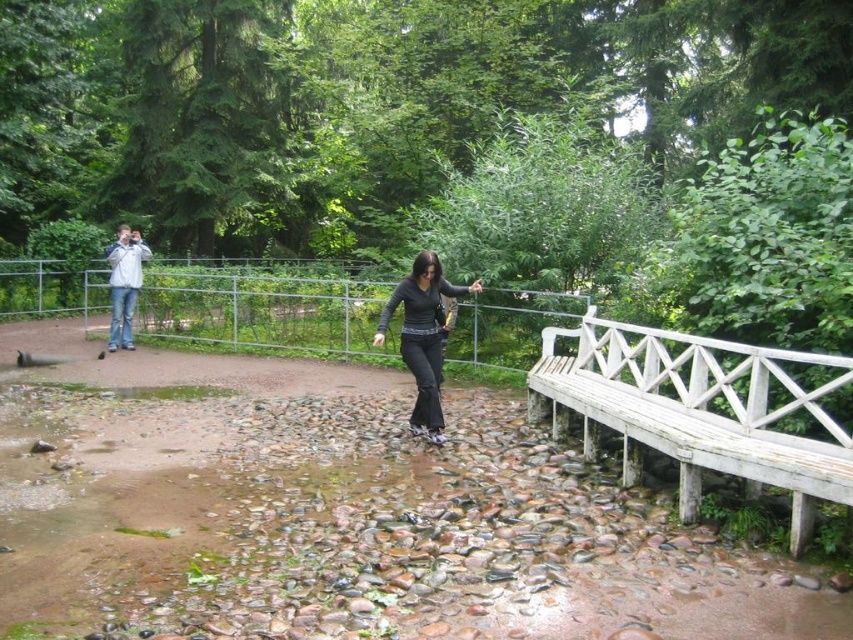
Question: Is the position of metallic wire fence at upper center more distant than that of black matte pants at center?

Choices:
 (A) yes
 (B) no

Answer: (A)

Question: Among these points, which one is farthest from the camera?

Choices:
 (A) (433, 333)
 (B) (534, 301)
 (C) (540, 392)

Answer: (B)

Question: Is white wooden bench at right positioned at the back of jeans at left?

Choices:
 (A) yes
 (B) no

Answer: (B)

Question: Estimate the real-world distances between objects in this image. Which object is farther from the metallic wire fence at upper center?

Choices:
 (A) white wooden bench at right
 (B) black matte pants at center

Answer: (B)

Question: Is metallic wire fence at upper center below jeans at left?

Choices:
 (A) yes
 (B) no

Answer: (A)

Question: Which point appears farthest from the camera in this image?

Choices:
 (A) (383, 323)
 (B) (837, 465)

Answer: (A)